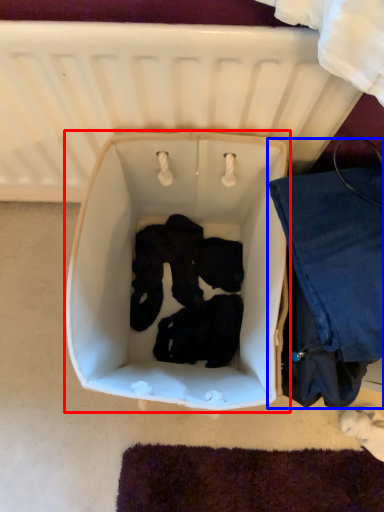
Question: Which point is further to the camera, baby carriage (highlighted by a red box) or clothing (highlighted by a blue box)?

Choices:
 (A) baby carriage
 (B) clothing

Answer: (A)